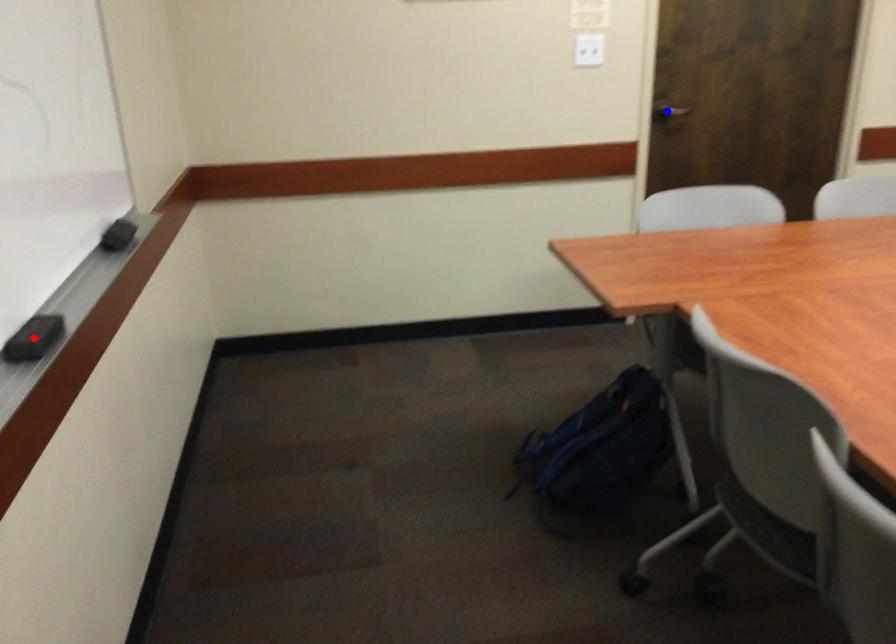
Question: Which of the two points in the image is closer to the camera?

Choices:
 (A) Blue point is closer.
 (B) Red point is closer.

Answer: (B)